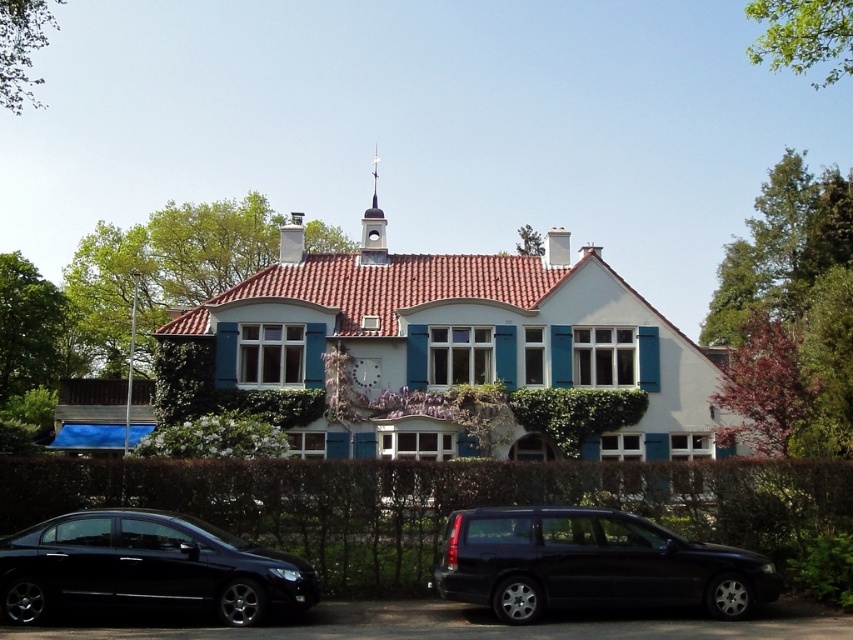
You are a delivery person trying to park your 1.8 meters tall delivery box in front of the house. You see the green hedge at lower center and the black glossy sedan at lower left. Which object is taller so that the box can be placed behind it without being seen from the road?

The green hedge at lower center is taller than the black glossy sedan at lower left, so placing the delivery box behind the green hedge at lower center would hide it from view.

You are a delivery person trying to park your van in the driveway of the house. You see a black metallic car at lower center and a black glossy sedan at lower left. Which vehicle should you move to make space for your van?

The black metallic car at lower center has a larger size compared to black glossy sedan at lower left, so you should move the black glossy sedan at lower left to create more space for your van.

You are standing in front of the house and see the green hedge at lower center and the black metallic car at lower center. Which object is positioned to the left when viewed from your perspective?

The green hedge at lower center is to the left of the black metallic car at lower center from the observer perspective.